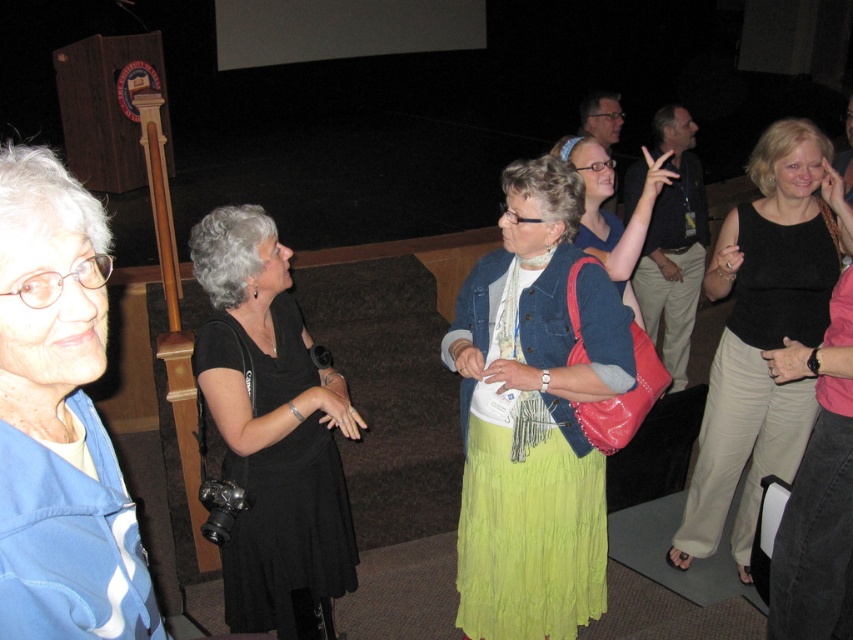
You are a photographer holding a camera and want to take a clear photo of the blue fabric jacket at upper left. Considering your current position, is the jacket within a comfortable distance for a sharp closeup shot?

The blue fabric jacket at upper left is 33.10 inches away from the camera. Since 33.10 inches is a comfortable distance for a sharp closeup, the jacket is within range.

You are standing at the entrance of the auditorium and see the blue fabric jacket at upper left. Can you determine its exact position using the coordinate system provided?

The blue fabric jacket at upper left is located at point (59,422) in the coordinate system.

You are standing at the entrance of the auditorium and see the blue fabric jacket at upper left. Can you determine if the jacket is closer to the stage or the entrance based on its position?

The blue fabric jacket at upper left is located at point (x=59, y=422), which places it closer to the entrance than the stage.